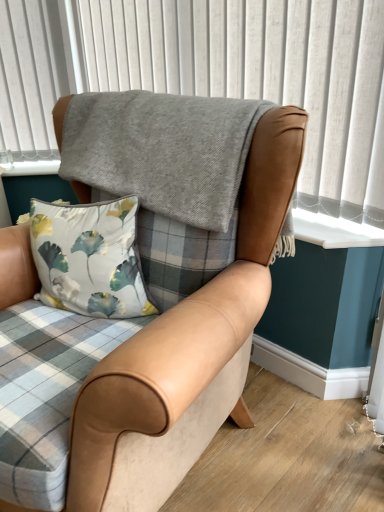
Question: From a real-world perspective, is tan leather chair at center above or below gray woolen blanket at upper center?

Choices:
 (A) below
 (B) above

Answer: (A)

Question: In terms of size, does tan leather chair at center appear bigger or smaller than gray woolen blanket at upper center?

Choices:
 (A) big
 (B) small

Answer: (A)

Question: Is tan leather chair at center inside or outside of gray woolen blanket at upper center?

Choices:
 (A) outside
 (B) inside

Answer: (A)

Question: Considering the positions of point (256, 68) and point (147, 417), is point (256, 68) closer or farther from the camera than point (147, 417)?

Choices:
 (A) closer
 (B) farther

Answer: (B)

Question: In the image, is gray woolen blanket at upper center positioned in front of or behind tan leather chair at center?

Choices:
 (A) behind
 (B) front

Answer: (A)

Question: Considering the positions of gray woolen blanket at upper center and tan leather chair at center in the image, is gray woolen blanket at upper center wider or thinner than tan leather chair at center?

Choices:
 (A) wide
 (B) thin

Answer: (B)

Question: Is gray woolen blanket at upper center situated inside tan leather chair at center or outside?

Choices:
 (A) inside
 (B) outside

Answer: (B)